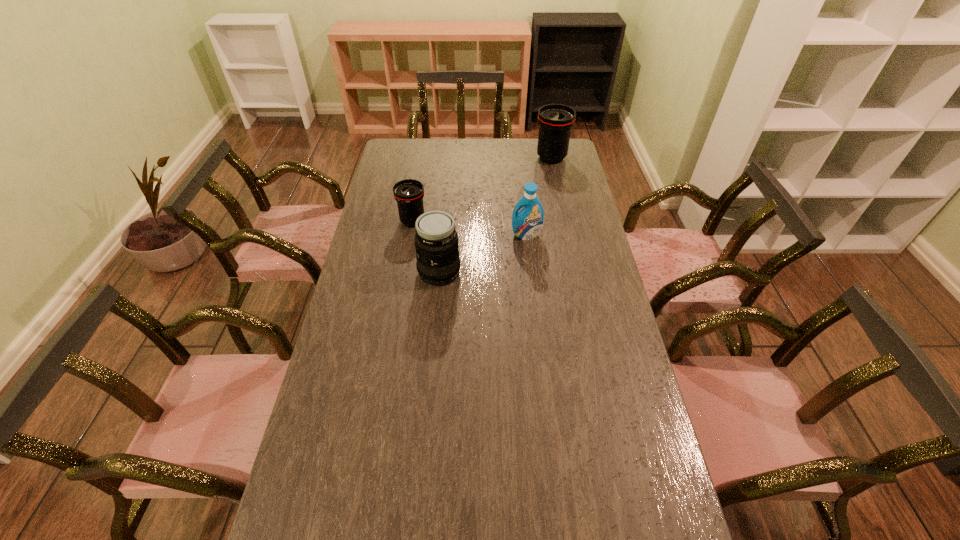
What are the coordinates of `the rightmost object` in the screenshot? It's located at (555, 121).

Locate an element on the screen. This screenshot has width=960, height=540. the farthest telephoto lens is located at coordinates (x=555, y=121).

Find the location of a particular element. the nearest object is located at coordinates (436, 241).

Where is `the second object from right to left`? The image size is (960, 540). the second object from right to left is located at coordinates (526, 224).

This screenshot has width=960, height=540. Find the location of `the shortest object`. the shortest object is located at coordinates (409, 193).

You are a GUI agent. You are given a task and a screenshot of the screen. Output one action in this format:
    pyautogui.click(x=<x>, y=<y>)
    Task: Click on the second farthest telephoto lens
    
    Given the screenshot: What is the action you would take?
    pyautogui.click(x=409, y=193)

Find the location of a particular element. This screenshot has width=960, height=540. vacant space positioned on the left of the farthest object is located at coordinates (505, 158).

At what (x,y) coordinates should I click in order to perform the action: click on free space located 0.330m on the right of the nearest object. Please return your answer as a coordinate pair (x, y). This screenshot has width=960, height=540. Looking at the image, I should click on (553, 272).

At what (x,y) coordinates should I click in order to perform the action: click on free spot located on the front-facing side of the detergent. Please return your answer as a coordinate pair (x, y). The image size is (960, 540). Looking at the image, I should click on (532, 284).

The height and width of the screenshot is (540, 960). I want to click on vacant space located on the right of the shortest object, so (464, 221).